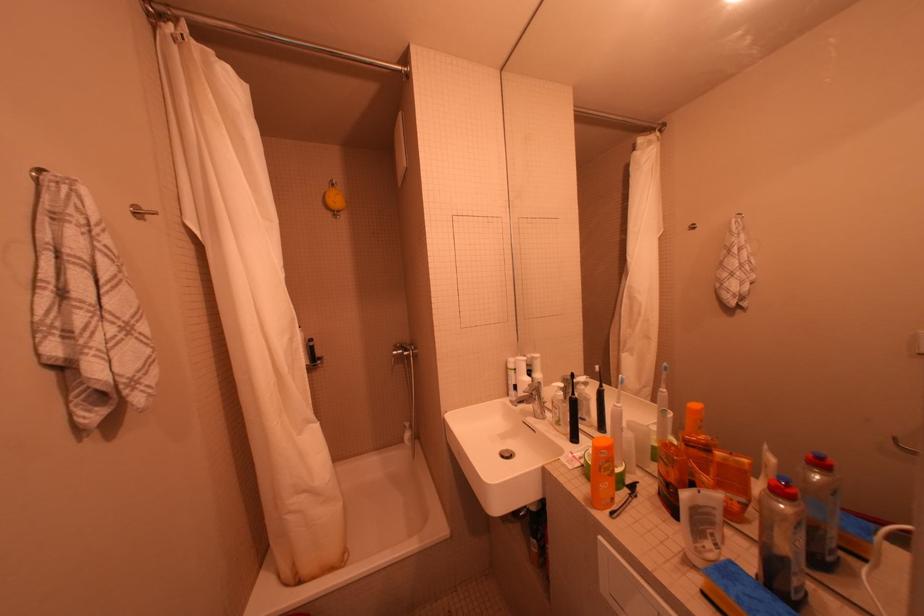
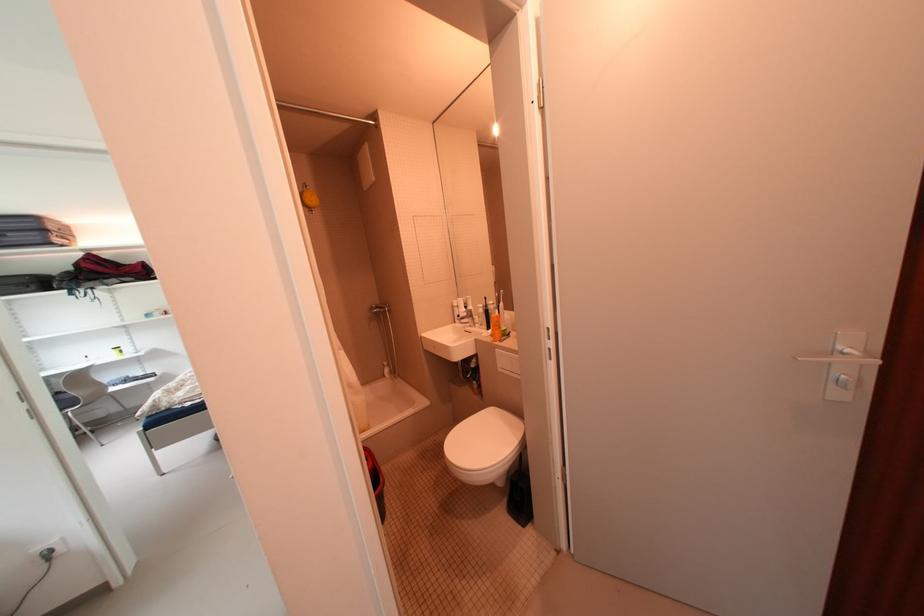
The point at (419, 428) is marked in the first image. Where is the corresponding point in the second image?

(396, 365)